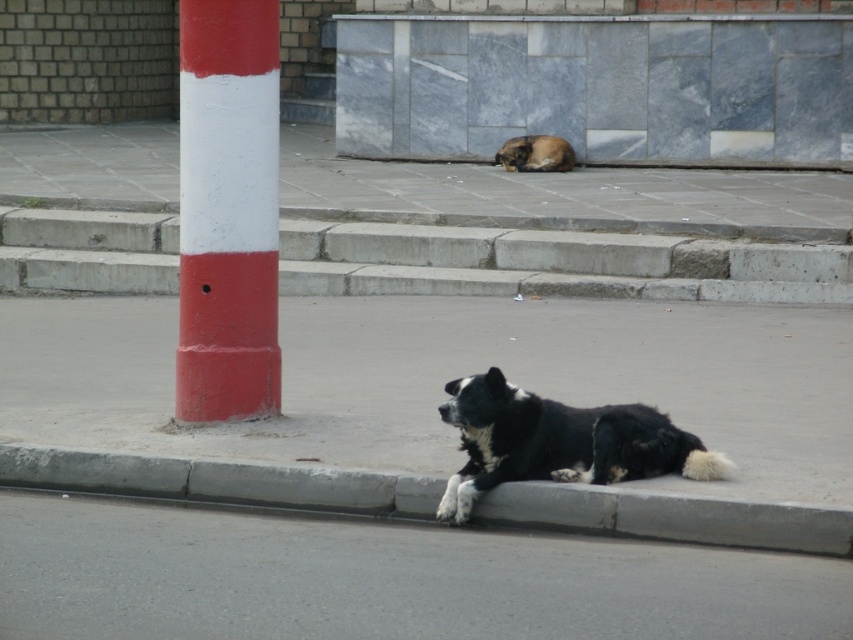
You are a delivery robot that needs to cross the sidewalk. You see the gray concrete curb at lower center and the black fur dog at lower center. Which object is taller?

The black fur dog at lower center is taller than the gray concrete curb at lower center.

You are a delivery person trying to deliver a package to the black fur dog at lower center. You are currently standing in front of the gray concrete curb at lower center. Can you directly hand the package to the dog without moving the curb?

The black fur dog at lower center is behind the gray concrete curb at lower center, so you cannot directly hand the package to the dog without moving the curb.